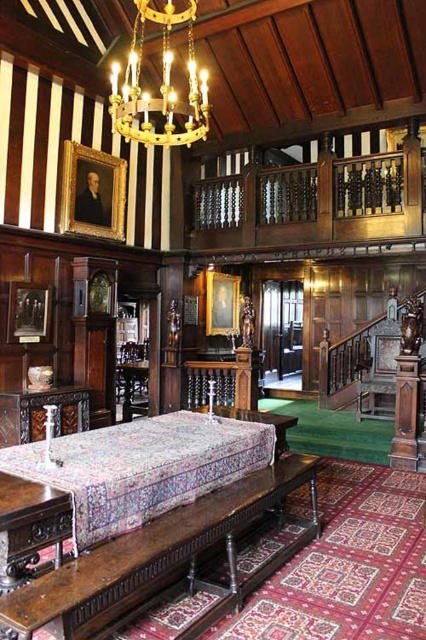
Question: Which point is farther from the camera taking this photo?

Choices:
 (A) (126, 76)
 (B) (267, 497)

Answer: (A)

Question: Is polished dark wood table at center positioned in front of gold metallic chandelier at upper center?

Choices:
 (A) no
 (B) yes

Answer: (B)

Question: Does polished dark wood table at center have a lesser width compared to gold metallic chandelier at upper center?

Choices:
 (A) no
 (B) yes

Answer: (A)

Question: Is polished dark wood table at center to the left of gold metallic chandelier at upper center from the viewer's perspective?

Choices:
 (A) yes
 (B) no

Answer: (B)

Question: Which point is closer to the camera?

Choices:
 (A) (219, 518)
 (B) (169, 1)

Answer: (A)